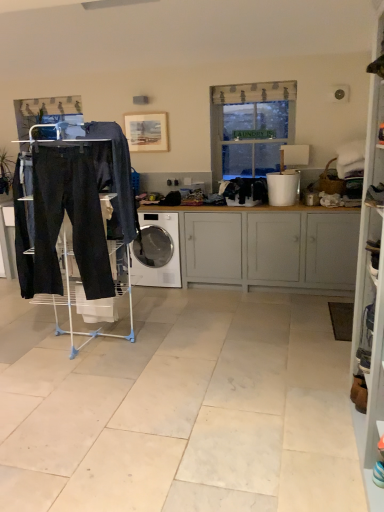
Question: Choose the correct answer: Is translucent fabric window at center inside white plastic bucket at right or outside it?

Choices:
 (A) inside
 (B) outside

Answer: (B)

Question: From the image's perspective, is translucent fabric window at center located above or below white plastic bucket at right?

Choices:
 (A) above
 (B) below

Answer: (A)

Question: Which of these objects is positioned closest to the white painted wood cabinet at center?

Choices:
 (A) translucent fabric window at center
 (B) white plastic bucket at right
 (C) wooden frame at upper center
 (D) black fabric clothes at center, which is the 1th clothing in right-to-left order
 (E) matte black drying rack at left

Answer: (D)

Question: Which of these objects is positioned farthest from the dark gray fabric pants at center, marked as the second clothing in a back-to-front arrangement?

Choices:
 (A) white painted wood cabinet at center
 (B) matte black drying rack at left
 (C) black fabric clothes at center, positioned as the second clothing in front-to-back order
 (D) wooden frame at upper center
 (E) translucent fabric window at center

Answer: (E)